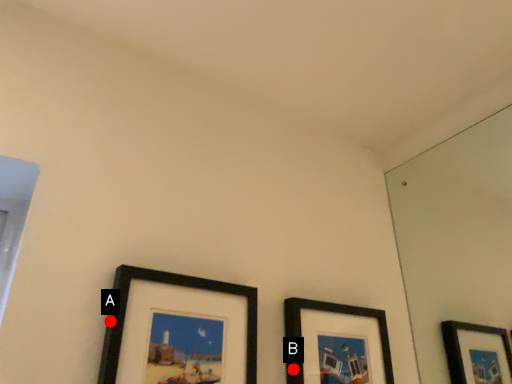
Question: Two points are circled on the image, labeled by A and B beside each circle. Which point is closer to the camera?

Choices:
 (A) A is closer
 (B) B is closer

Answer: (A)